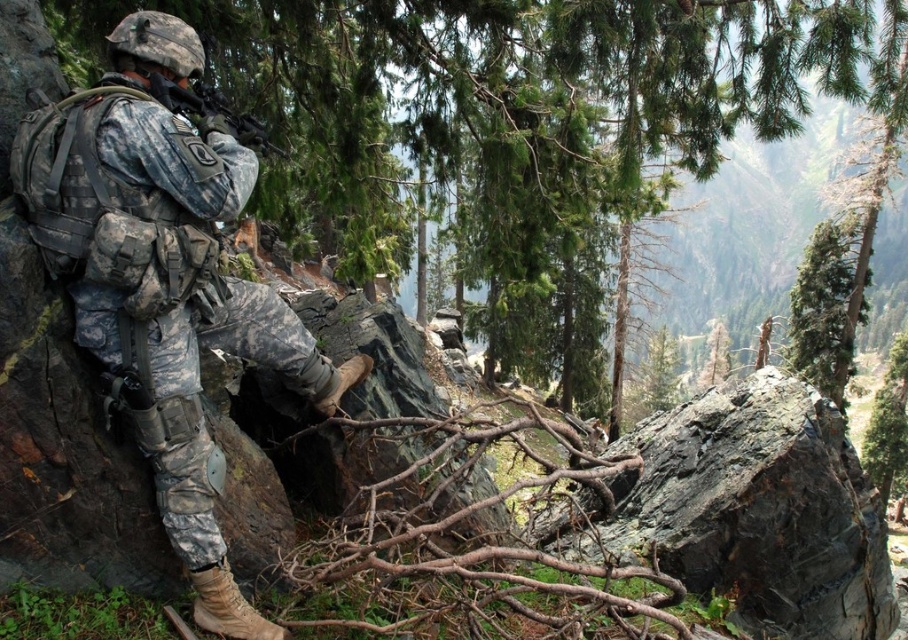
Question: Does camouflage fabric uniform at left have a lesser width compared to matte black rifle at center?

Choices:
 (A) yes
 (B) no

Answer: (B)

Question: Among these points, which one is farthest from the camera?

Choices:
 (A) (849, 282)
 (B) (265, 148)
 (C) (218, 216)

Answer: (A)

Question: Can you confirm if camouflage fabric uniform at left is positioned to the right of green rough bark tree at upper right?

Choices:
 (A) yes
 (B) no

Answer: (B)

Question: Which object is closer to the camera taking this photo?

Choices:
 (A) green rough bark tree at upper right
 (B) camouflage fabric uniform at left
 (C) matte black rifle at center

Answer: (B)

Question: Can you confirm if green rough bark tree at upper right is positioned to the left of matte black rifle at center?

Choices:
 (A) yes
 (B) no

Answer: (B)

Question: Among these points, which one is farthest from the camera?

Choices:
 (A) (824, 292)
 (B) (173, 84)
 (C) (27, 148)

Answer: (A)